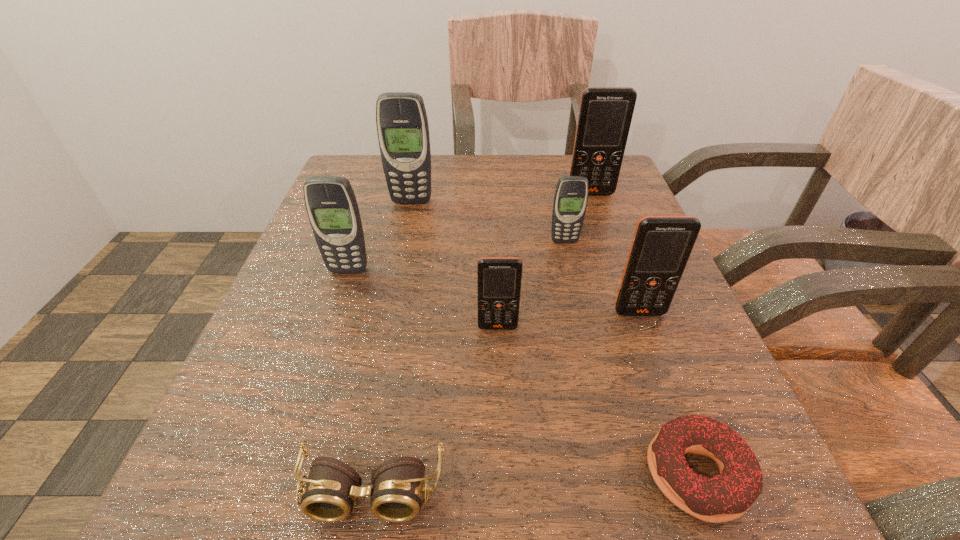
The width and height of the screenshot is (960, 540). What are the coordinates of `free spot located 0.060m on the screen of the sixth farthest object` in the screenshot? It's located at (499, 363).

The height and width of the screenshot is (540, 960). Identify the location of free space located 0.280m on the screen of the second nearest gray cellular telephone. [x=593, y=366].

Locate an element on the screen. This screenshot has height=540, width=960. vacant space located on the back of the doughnut is located at coordinates (613, 245).

This screenshot has width=960, height=540. Identify the location of goggles that is at the near edge. (329, 495).

Locate an element on the screen. The height and width of the screenshot is (540, 960). doughnut located in the near edge section of the desktop is located at coordinates (726, 496).

Identify the location of goggles located at the left edge. This screenshot has width=960, height=540. (329, 495).

Locate an element on the screen. This screenshot has width=960, height=540. doughnut positioned at the right edge is located at coordinates point(726,496).

The height and width of the screenshot is (540, 960). I want to click on object present at the far left corner, so click(x=402, y=125).

You are a GUI agent. You are given a task and a screenshot of the screen. Output one action in this format:
    pyautogui.click(x=<x>, y=<y>)
    Task: Click on the object positioned at the near left corner
    The height and width of the screenshot is (540, 960).
    Given the screenshot: What is the action you would take?
    [329, 495]

What are the coordinates of `object positioned at the far right corner` in the screenshot? It's located at (605, 114).